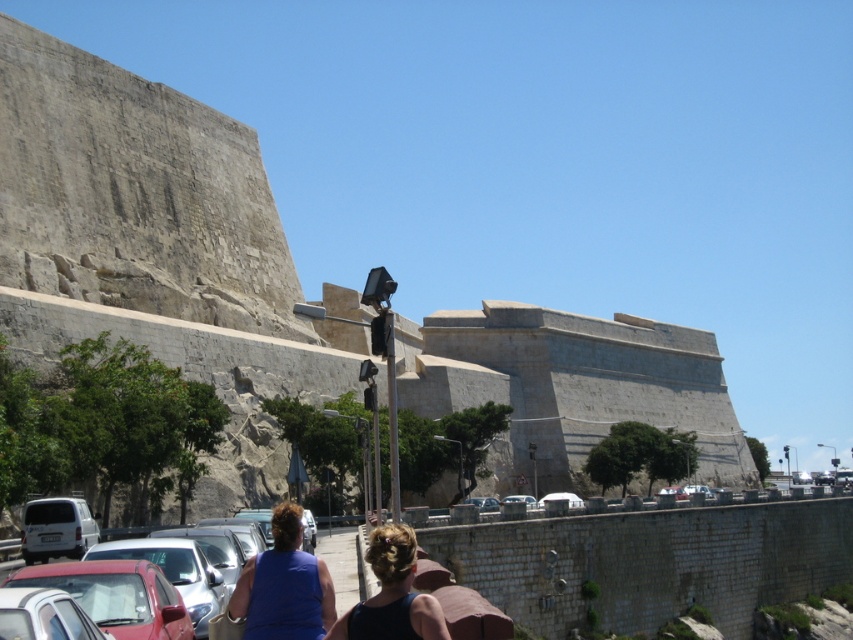
Question: Among these objects, which one is farthest from the camera?

Choices:
 (A) dark blue fabric at center
 (B) blue matte shirt at lower center

Answer: (B)

Question: Which is nearer to the matte red car at lower left?

Choices:
 (A) gray stone wall at center
 (B) blue matte shirt at lower center

Answer: (B)

Question: Observing the image, what is the correct spatial positioning of dark blue fabric at center in reference to silver metallic car at center?

Choices:
 (A) left
 (B) right

Answer: (A)

Question: Can you confirm if dark blue fabric at center is wider than silver metallic car at center?

Choices:
 (A) yes
 (B) no

Answer: (A)

Question: Considering the relative positions of blue matte shirt at lower center and white matte car at center in the image provided, where is blue matte shirt at lower center located with respect to white matte car at center?

Choices:
 (A) below
 (B) above

Answer: (B)

Question: Which object is the closest to the white matte car at center?

Choices:
 (A) matte red car at lower left
 (B) gray stone wall at center

Answer: (B)